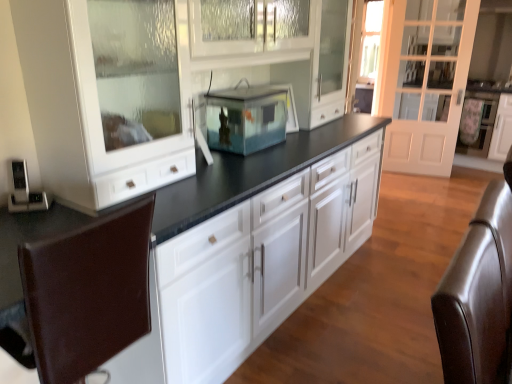
Question: Is white glossy cabinet at center wider or thinner than brown leather swivel chair at lower left, which is counted as the first swivel chair, starting from the left?

Choices:
 (A) thin
 (B) wide

Answer: (B)

Question: Relative to brown leather swivel chair at lower left, which is counted as the first swivel chair, starting from the left, is white glossy cabinet at center in front or behind?

Choices:
 (A) front
 (B) behind

Answer: (B)

Question: Considering the real-world distances, which object is closest to the black granite countertop at center?

Choices:
 (A) transparent glass fish tank at center
 (B) white glossy oven at right, the 1th appliance from the right
 (C) brown leather swivel chair at right, marked as the 1th swivel chair in a right-to-left arrangement
 (D) brown leather swivel chair at lower left, which is counted as the first swivel chair, starting from the left
 (E) white glossy cabinet at center

Answer: (A)

Question: Estimate the real-world distances between objects in this image. Which object is farther from the white glass door at right?

Choices:
 (A) white glossy oven at right, which is the 2th appliance from bottom to top
 (B) brown leather swivel chair at lower left, which is counted as the first swivel chair, starting from the left
 (C) matte black speaker at left, arranged as the 1th appliance when viewed from the front
 (D) transparent glass fish tank at center
 (E) brown leather swivel chair at right, marked as the 1th swivel chair in a right-to-left arrangement

Answer: (C)